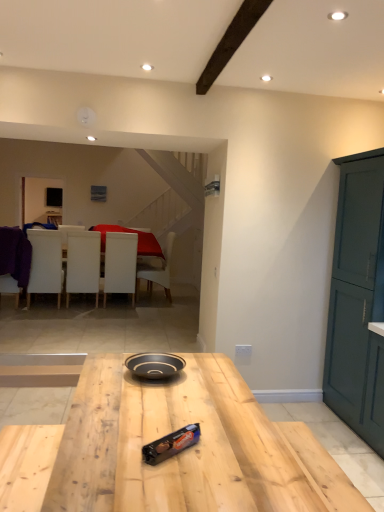
Where is `vacant area to the right of matte black bowl at center`? This screenshot has height=512, width=384. vacant area to the right of matte black bowl at center is located at coordinates (213, 377).